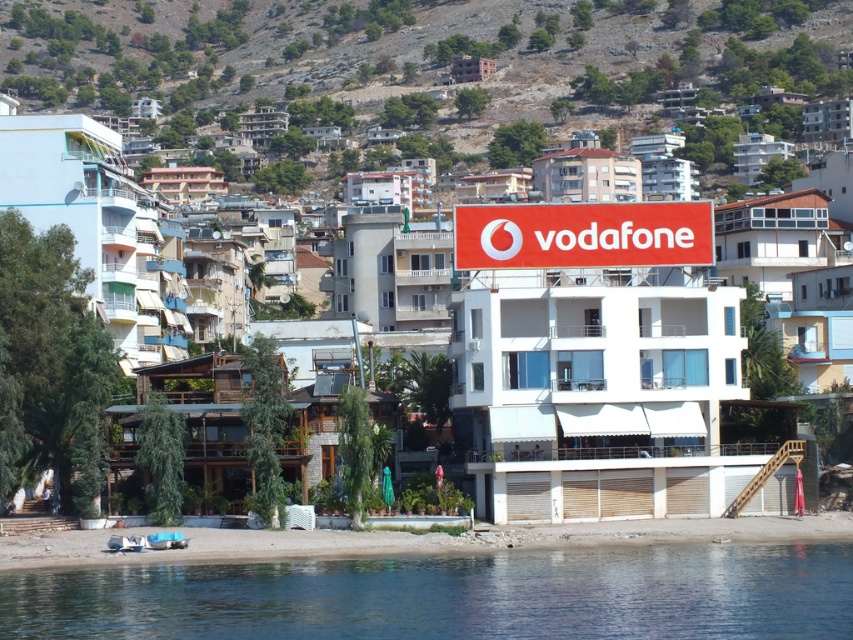
You are a tourist standing on the smooth sand beach at lower center and want to take a photo of the red matte sign at center. Can you see the sign clearly from your current position?

The smooth sand beach at lower center is in front of the red matte sign at center, so the sign is behind the beach. Since you are on the beach, you can see the sign clearly as it is positioned behind the beach area.

You are standing at the point with coordinates point (619, 541) and want to walk towards the Vodafone advertisement sign. Is the point (540, 314) blocking your path?

The point (540, 314) is behind point (619, 541), so it is not blocking your path to the Vodafone advertisement sign.